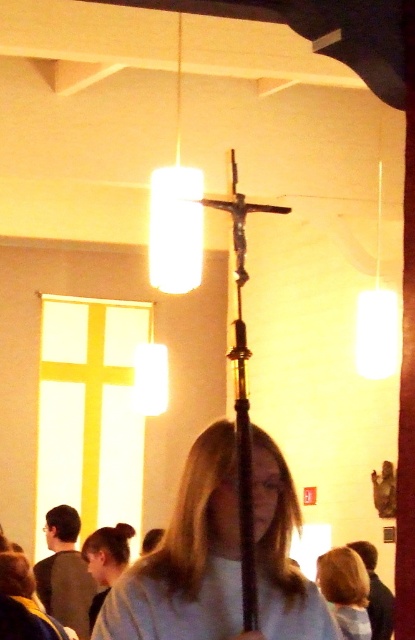
Can you confirm if light blue fabric at center is taller than blonde hair at lower left?

No, light blue fabric at center is not taller than blonde hair at lower left.

Image resolution: width=415 pixels, height=640 pixels. Describe the element at coordinates (209, 609) in the screenshot. I see `light blue fabric at center` at that location.

Find the location of `light blue fabric at center`. light blue fabric at center is located at coordinates (209, 609).

What are the coordinates of `light blue fabric at center` in the screenshot? It's located at (209, 609).

Identify the location of smooth gray sweater at center. The height and width of the screenshot is (640, 415). (219, 556).

Who is higher up, smooth gray sweater at center or blonde hair at center?

smooth gray sweater at center

Does point (214, 424) come farther from viewer compared to point (344, 557)?

No.

Identify the location of smooth gray sweater at center. (219, 556).

Is smooth gray sweater at center positioned before light blue fabric at center?

No, smooth gray sweater at center is further to the viewer.

Describe the element at coordinates (219, 556) in the screenshot. I see `smooth gray sweater at center` at that location.

Locate an element on the screen. smooth gray sweater at center is located at coordinates (219, 556).